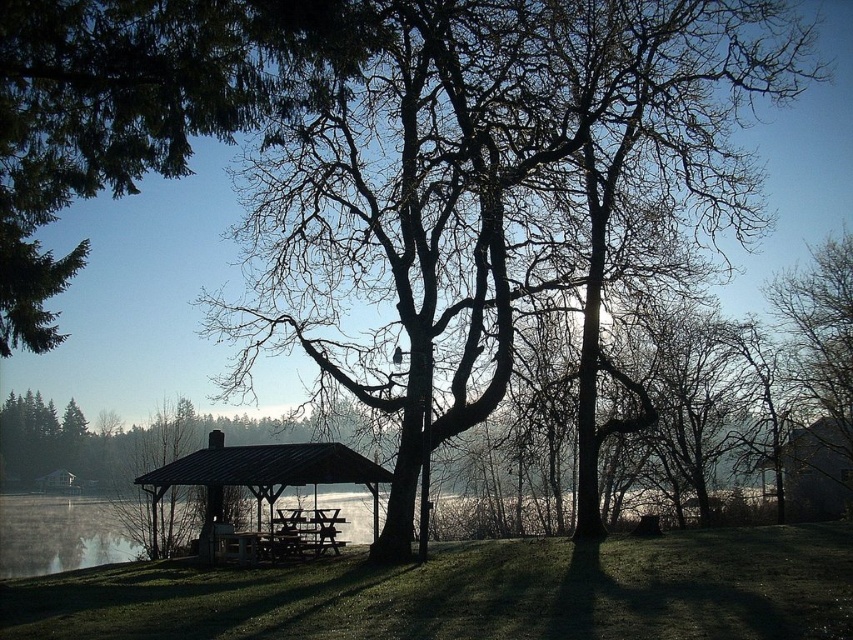
The height and width of the screenshot is (640, 853). I want to click on green leafy tree at upper left, so click(135, 108).

Which is more to the left, green leafy tree at upper left or clear water at center?

green leafy tree at upper left is more to the left.

Is point (151, 4) farther from camera compared to point (50, 509)?

No, it is in front of (50, 509).

Identify the location of green leafy tree at upper left. (135, 108).

Which is behind, point (126, 557) or point (229, 452)?

The point (126, 557) is behind.

Between clear water at center and matte black gazebo at center, which one appears on the right side from the viewer's perspective?

matte black gazebo at center

Describe the element at coordinates (59, 534) in the screenshot. The height and width of the screenshot is (640, 853). I see `clear water at center` at that location.

This screenshot has width=853, height=640. What are the coordinates of `clear water at center` in the screenshot? It's located at (59, 534).

Identify the location of green leafy tree at upper left. Image resolution: width=853 pixels, height=640 pixels. (135, 108).

Can you confirm if green leafy tree at upper left is bigger than matte black gazebo at center?

Yes.

Is point (263, 115) positioned after point (294, 444)?

No, (263, 115) is in front of (294, 444).

Find the location of `green leafy tree at upper left`. green leafy tree at upper left is located at coordinates point(135,108).